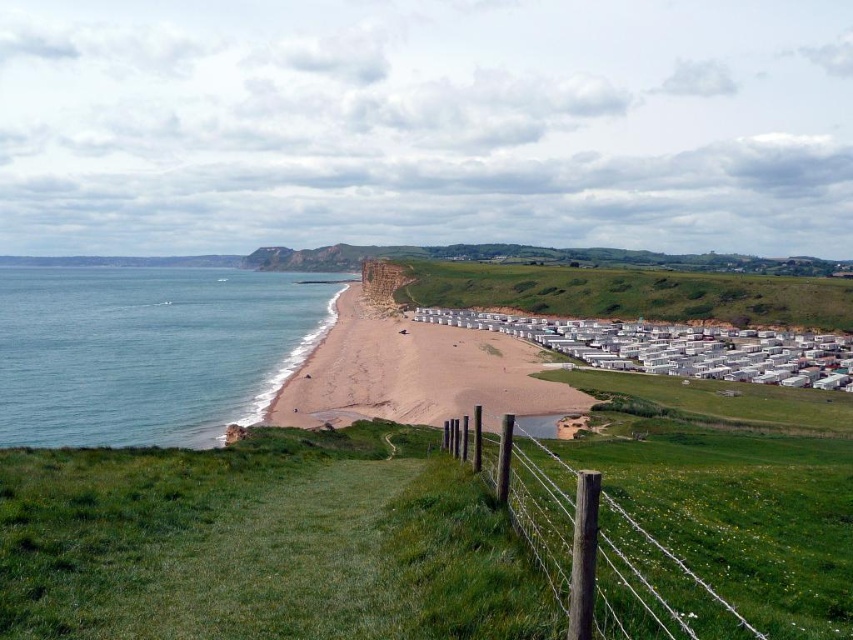
Question: Which of the following is the closest to the observer?

Choices:
 (A) blue water at lower left
 (B) light brown sand at center

Answer: (A)

Question: Considering the relative positions of blue water at lower left and light brown sand at center in the image provided, where is blue water at lower left located with respect to light brown sand at center?

Choices:
 (A) above
 (B) below

Answer: (A)

Question: Does blue water at lower left have a smaller size compared to light brown sand at center?

Choices:
 (A) yes
 (B) no

Answer: (B)

Question: Among these points, which one is nearest to the camera?

Choices:
 (A) (326, 385)
 (B) (157, 404)

Answer: (B)

Question: Which object appears closest to the camera in this image?

Choices:
 (A) light brown sand at center
 (B) blue water at lower left

Answer: (B)

Question: Can you confirm if blue water at lower left is positioned to the left of light brown sand at center?

Choices:
 (A) yes
 (B) no

Answer: (A)